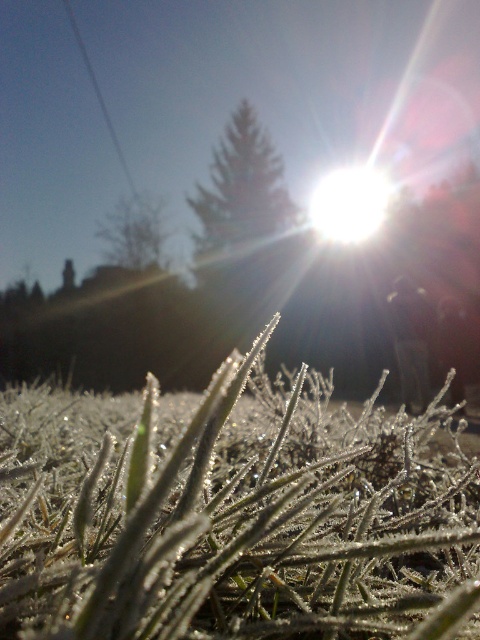
You are a photographer planning to take a photo of the green textured pine tree at center and the green matte tree at upper center. If your camera can only focus on objects within a 5 feet range, will both trees be in focus?

The green textured pine tree at center and the green matte tree at upper center are 8.09 feet apart. Since the camera can only focus on objects within a 5 feet range, the distance between them exceeds the focus range, so both trees cannot be in focus simultaneously.

You are a photographer adjusting your camera focus. You want to capture both the green textured pine tree at center and the green matte tree at upper center clearly. Based on the scene, which tree should you focus on first to ensure the other remains in acceptable focus?

You should focus on the green textured pine tree at center first because it is closer to the viewer than the green matte tree at upper center. By focusing on the closer object, the farther one may still be within the depth of field, ensuring both are acceptably sharp.

You are a photographer setting up a shot of the frosted glass at center and the green matte tree at upper center. Which object should you focus on to ensure the subject is sharp, considering the shallow depth of field?

The frosted glass at center should be focused on because it is closer to the camera than the green matte tree at upper center, ensuring sharpness with the shallow depth of field.